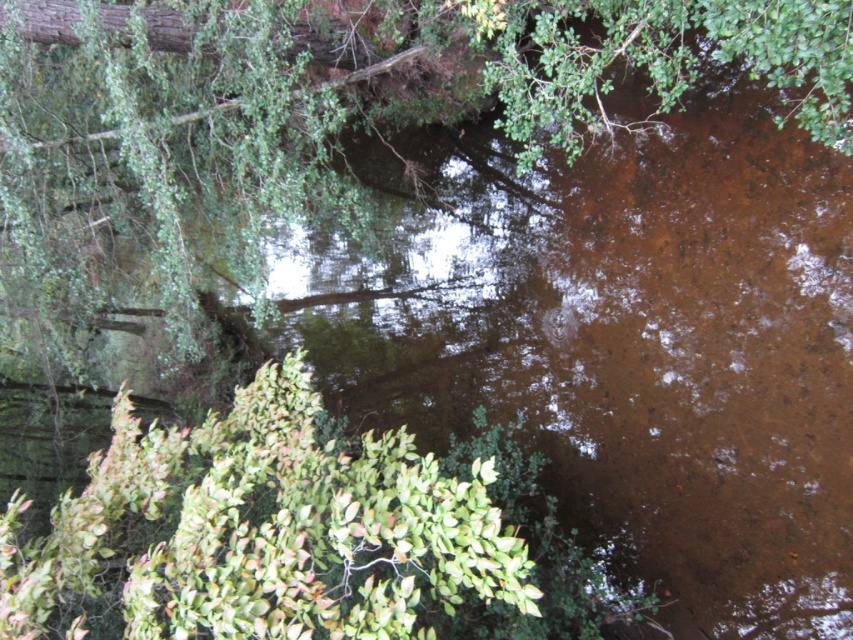
Which is more to the right, green leafy tree at upper left or green leafy bush at lower left?

From the viewer's perspective, green leafy bush at lower left appears more on the right side.

Can you confirm if green leafy tree at upper left is smaller than green leafy bush at lower left?

Yes, green leafy tree at upper left is smaller than green leafy bush at lower left.

The height and width of the screenshot is (640, 853). Describe the element at coordinates (389, 72) in the screenshot. I see `green leafy tree at upper left` at that location.

Identify the location of green leafy tree at upper left. (389, 72).